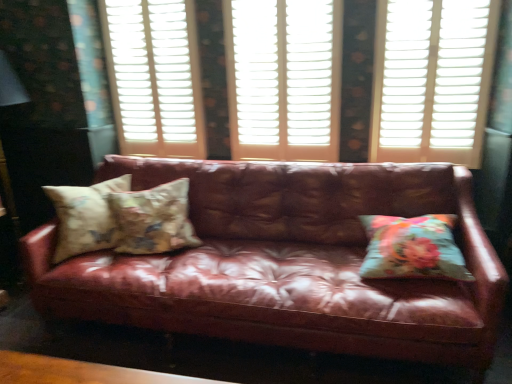
Locate an element on the screen. Image resolution: width=512 pixels, height=384 pixels. free space above white plastic shutters at center, acting as the 1th window frame starting from the left (from a real-world perspective) is located at coordinates [129, 0].